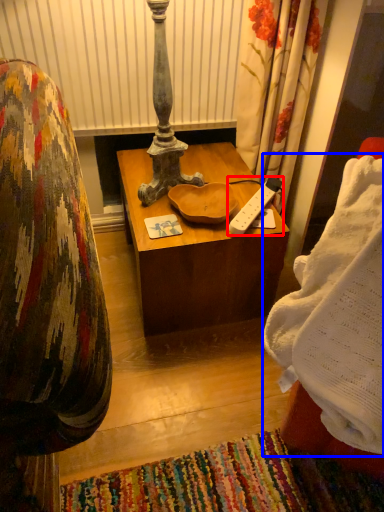
Question: Among these objects, which one is farthest to the camera, remote control (highlighted by a red box) or blanket (highlighted by a blue box)?

Choices:
 (A) remote control
 (B) blanket

Answer: (A)